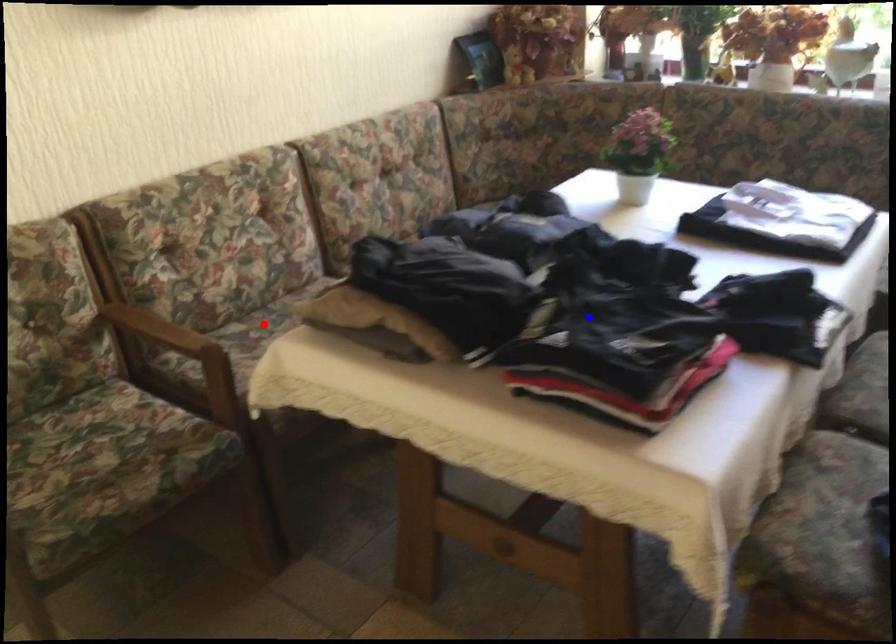
Question: Two points are marked on the image. Which point is closer to the camera?

Choices:
 (A) Blue point is closer.
 (B) Red point is closer.

Answer: (A)